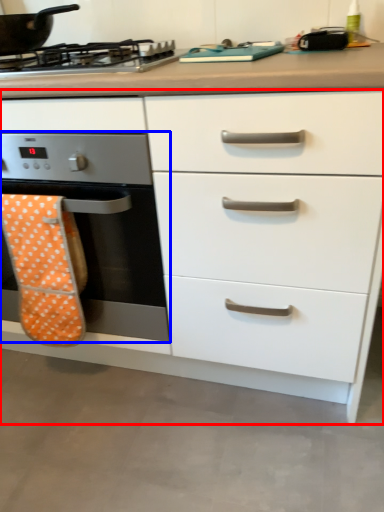
Question: Among these objects, which one is farthest to the camera, chest of drawers (highlighted by a red box) or home appliance (highlighted by a blue box)?

Choices:
 (A) chest of drawers
 (B) home appliance

Answer: (B)